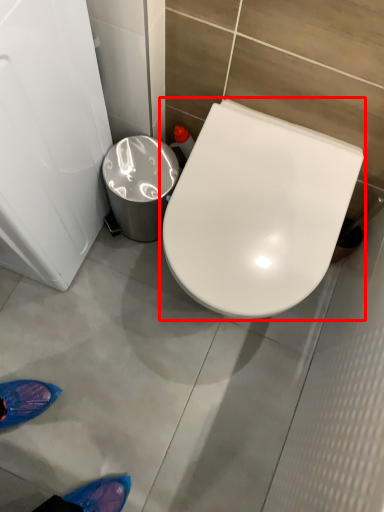
Question: In this image, where is toilet (annotated by the red box) located relative to trash bin/can?

Choices:
 (A) right
 (B) left

Answer: (A)